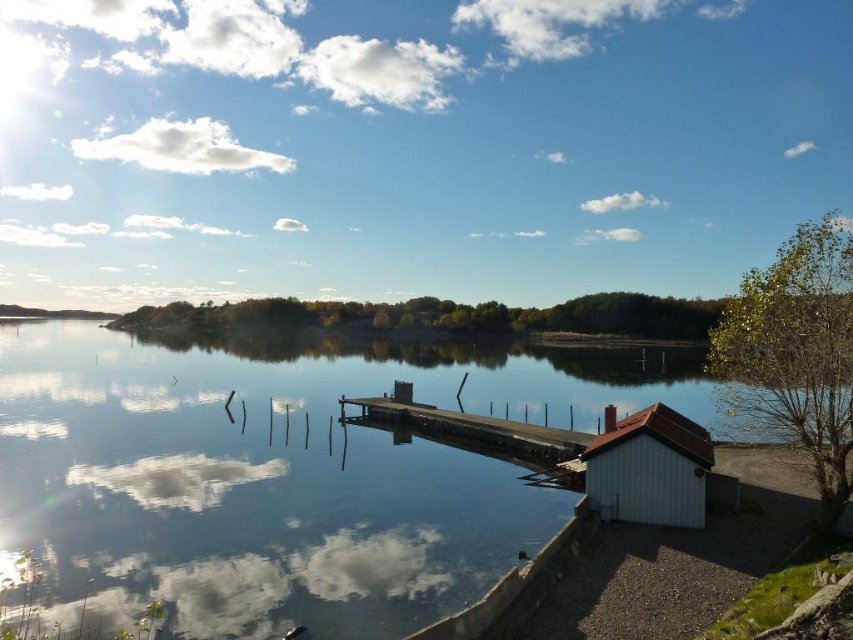
You are standing at the edge of the lake and want to reach the point marked at coordinates point (x=325, y=608). If you walk directly towards it along the shortest path, how far will you have to walk?

The point marked at coordinates point (x=325, y=608) is 13.13 meters away from you, so you will have to walk 13.13 meters to reach it.

You are a photographer wanting to capture the white wood hut at lower right and the transparent glass water at center in a single shot. Given the size difference between them, which object will occupy more of the frame in your photo?

The transparent glass water at center will occupy more of the frame because it is larger in size than the white wood hut at lower right according to the description.